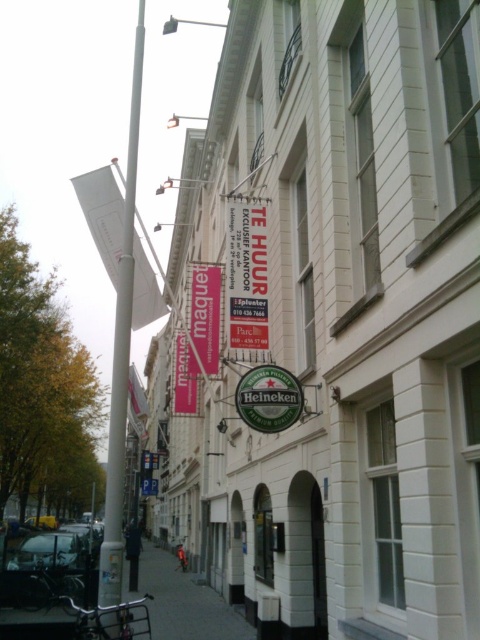
Question: Which object is positioned farthest from the white plastic pole at left?

Choices:
 (A) gray concrete sidewalk at lower center
 (B) white matte signboard at upper center

Answer: (A)

Question: Among these objects, which one is nearest to the camera?

Choices:
 (A) white matte signboard at upper center
 (B) white plastic pole at left

Answer: (A)

Question: Based on their relative distances, which object is farther from the gray concrete sidewalk at lower center?

Choices:
 (A) white plastic pole at left
 (B) white matte signboard at upper center

Answer: (A)

Question: Can you confirm if white matte signboard at upper center is positioned below white plastic pole at left?

Choices:
 (A) no
 (B) yes

Answer: (B)

Question: Does white matte signboard at upper center have a lesser width compared to gray concrete sidewalk at lower center?

Choices:
 (A) no
 (B) yes

Answer: (A)

Question: In this image, where is white plastic pole at left located relative to gray concrete sidewalk at lower center?

Choices:
 (A) left
 (B) right

Answer: (A)